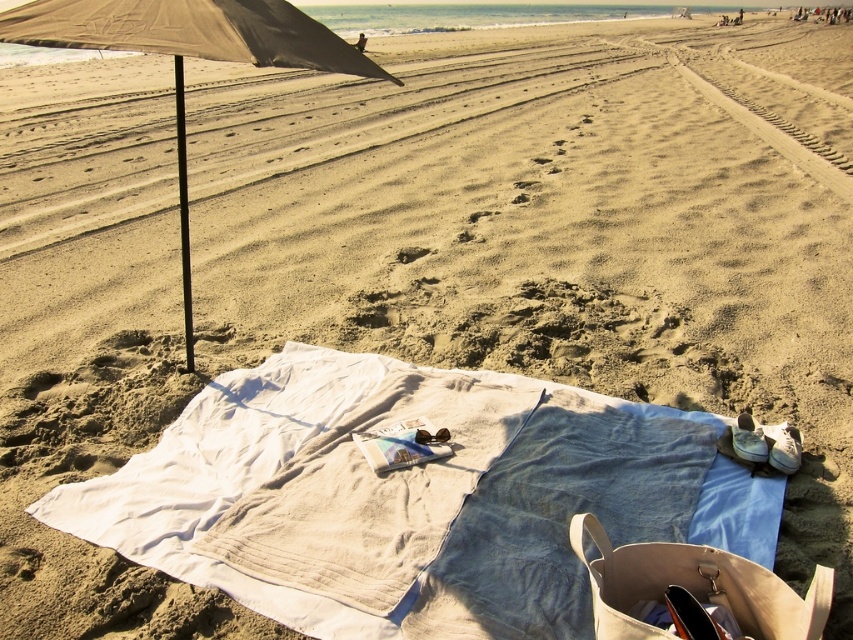
You are a beachgoer who wants to place a cooler between the beige fabric umbrella at left and the brown sand footprint at center. The cooler requires a minimum of 8 feet of space between the two objects to fit. Based on the scene, will the cooler fit?

The distance between the beige fabric umbrella at left and the brown sand footprint at center is 7.95 feet, which is slightly less than the required 8 feet. Therefore, the cooler will not fit between them.

You are standing at the beach and want to pick up an object located at point (259, 589) and another at point (207, 4). Which point is closer to you?

Point (259, 589) is closer to you than point (207, 4).